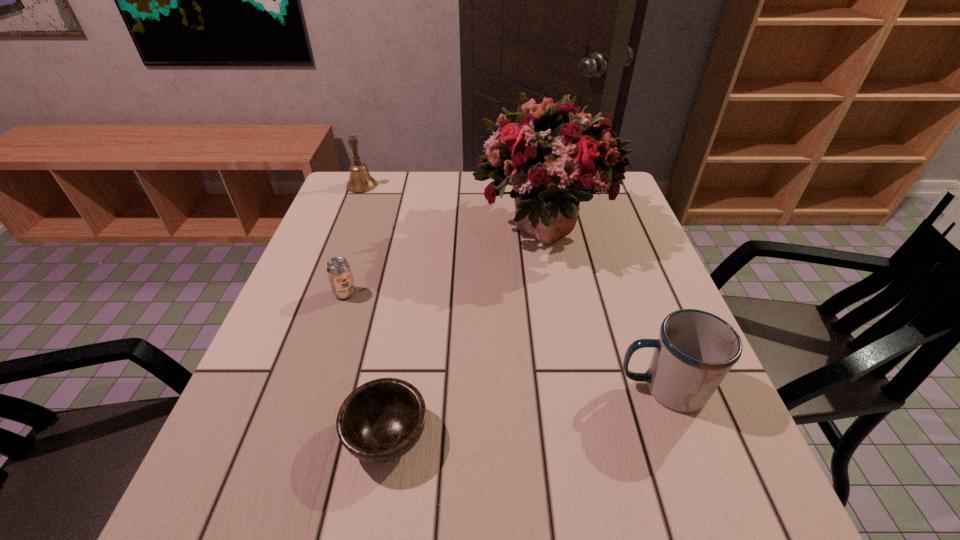
The width and height of the screenshot is (960, 540). I want to click on the tallest object, so click(553, 156).

At what (x,y) coordinates should I click in order to perform the action: click on bell. Please return your answer as a coordinate pair (x, y). Looking at the image, I should click on (360, 181).

This screenshot has height=540, width=960. In order to click on mug in this screenshot , I will do `click(695, 350)`.

Where is `the third farthest object`? The height and width of the screenshot is (540, 960). the third farthest object is located at coordinates (338, 269).

Locate an element on the screen. The width and height of the screenshot is (960, 540). the second shortest object is located at coordinates pos(338,269).

Find the location of `the shortest object`. the shortest object is located at coordinates (380, 421).

This screenshot has width=960, height=540. I want to click on the third object from left to right, so click(380, 421).

Find the location of a particular element. This screenshot has width=960, height=540. free region located on the front of the tallest object is located at coordinates (564, 347).

The width and height of the screenshot is (960, 540). Identify the location of vacant space located on the right of the bell. (507, 185).

The image size is (960, 540). What are the coordinates of `vacant space situated 0.140m on the handle side of the mug` in the screenshot? It's located at (541, 388).